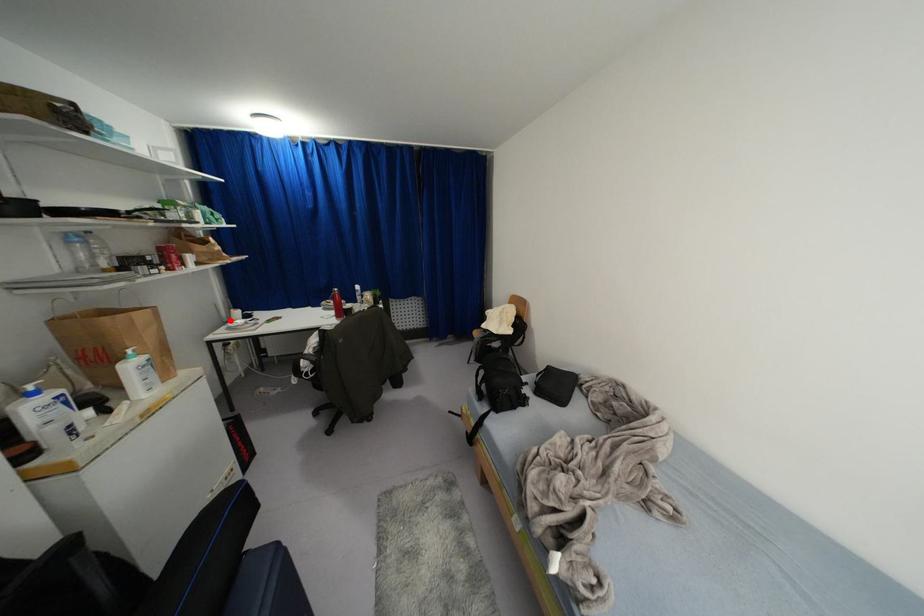
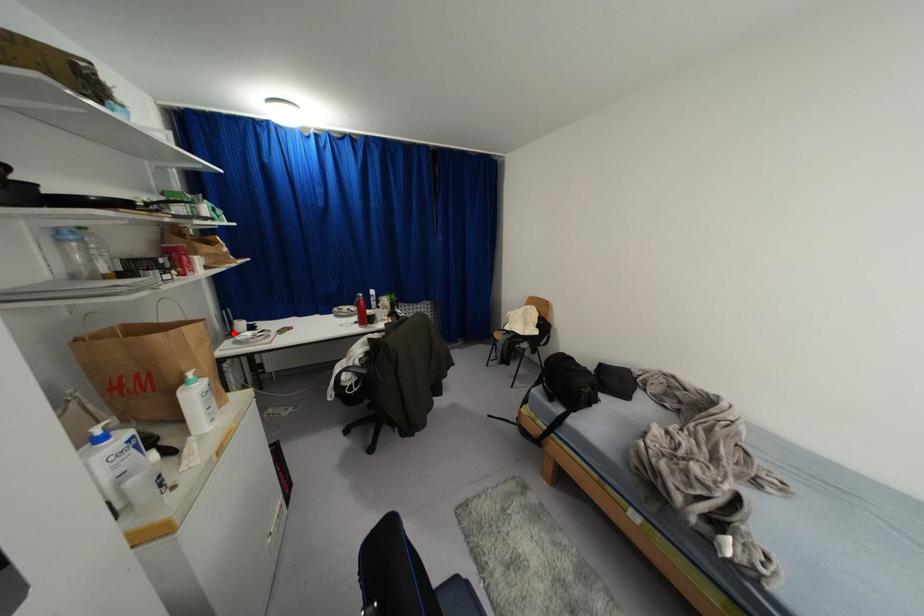
I am providing you with two images of the same scene from different viewpoints. A red point is marked on the first image and another point is marked on the second image. Do the highlighted points in image1 and image2 indicate the same real-world spot?

Yes